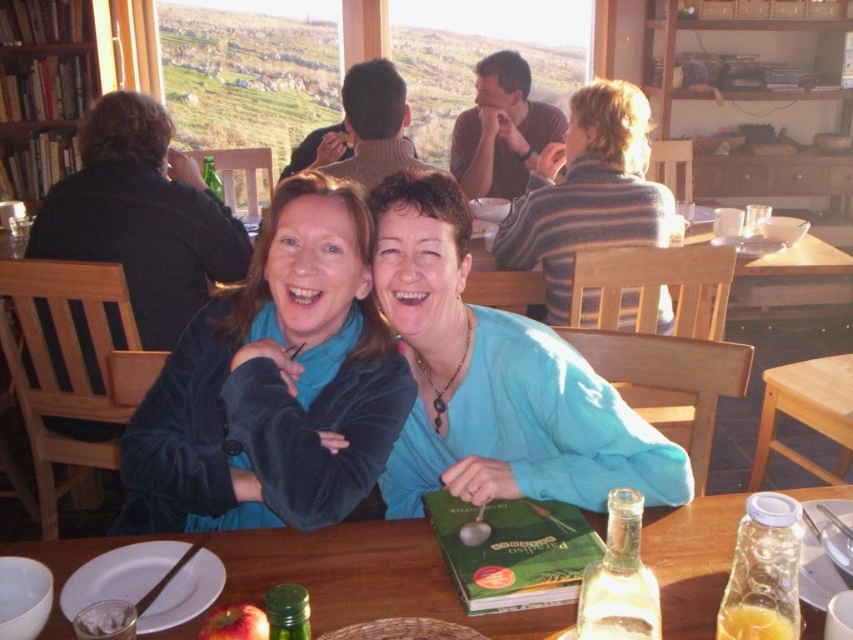
Question: Is blue fabric shirt at center positioned behind wooden bookshelf at upper left?

Choices:
 (A) no
 (B) yes

Answer: (A)

Question: Which point is farther to the camera?

Choices:
 (A) (314, 324)
 (B) (579, 204)
 (C) (250, 620)

Answer: (B)

Question: Is velvet blue sweater at center below striped sweater at center?

Choices:
 (A) yes
 (B) no

Answer: (A)

Question: Among these points, which one is farthest from the camera?

Choices:
 (A) (253, 595)
 (B) (339, 429)

Answer: (B)

Question: From the image, what is the correct spatial relationship of velvet blue sweater at center in relation to wooden table at lower center?

Choices:
 (A) below
 (B) above

Answer: (B)

Question: Which point is closer to the camera?

Choices:
 (A) velvet blue sweater at center
 (B) wooden table at lower center
 (C) wooden bookshelf at upper left
 (D) blue fabric shirt at center

Answer: (B)